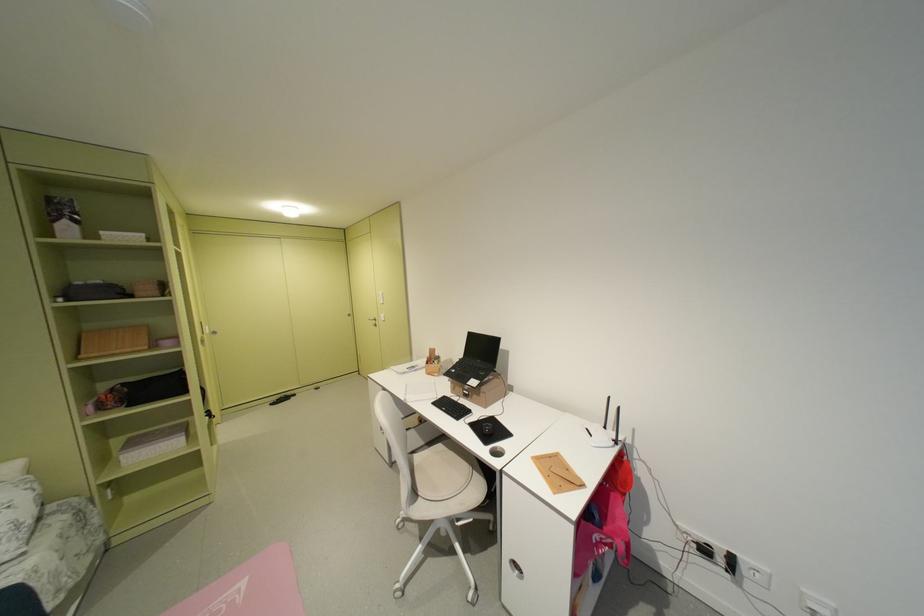
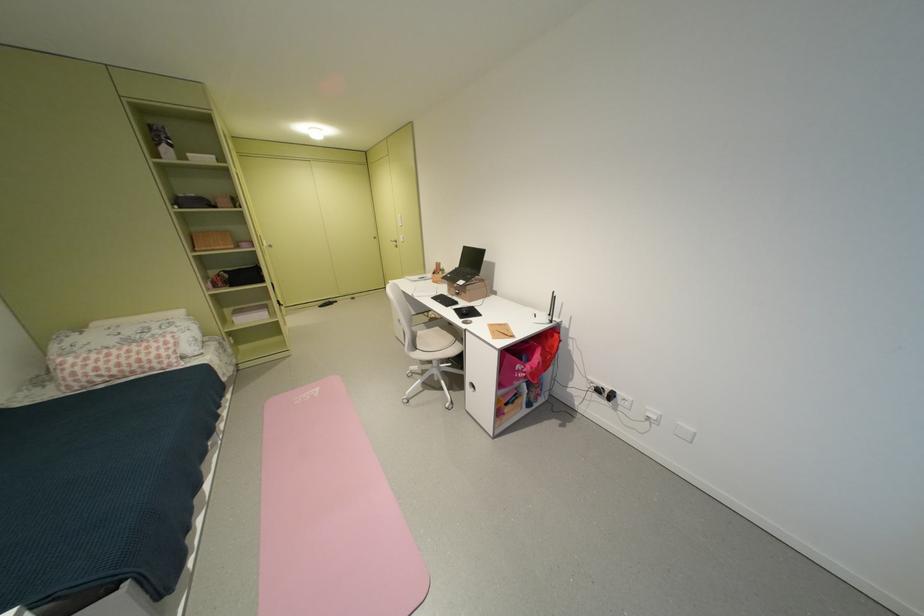
Find the pixel in the second image that matches point (445, 363) in the first image.

(450, 274)